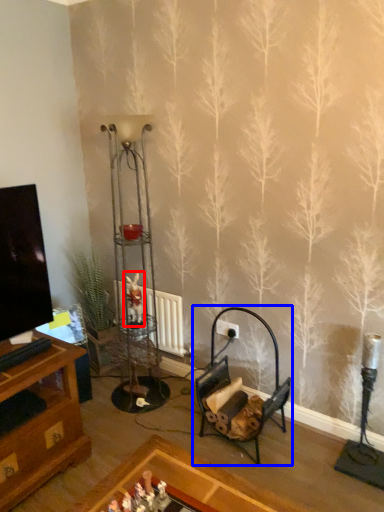
Question: Which point is closer to the camera, toy (highlighted by a red box) or rocking chair (highlighted by a blue box)?

Choices:
 (A) toy
 (B) rocking chair

Answer: (B)